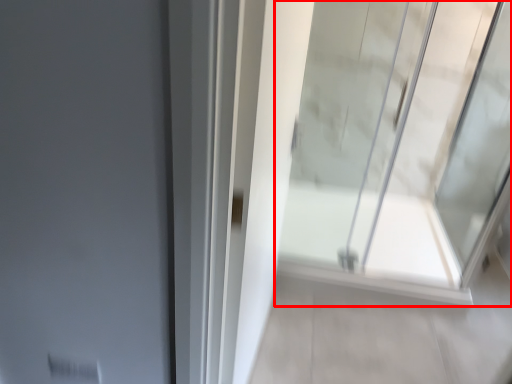
Question: From the image's perspective, where is window (annotated by the red box) located in relation to path in the image?

Choices:
 (A) below
 (B) above

Answer: (B)